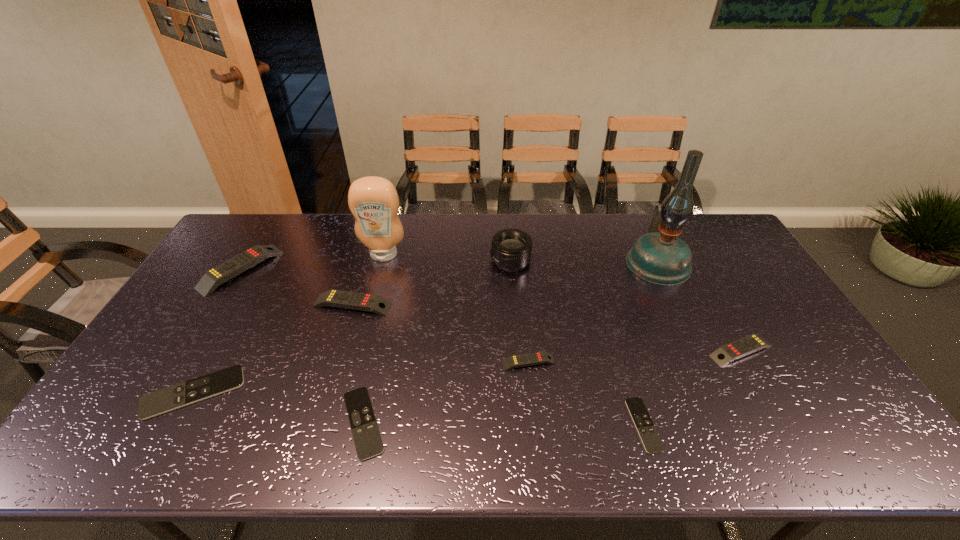
At what (x,y) coordinates should I click in order to perform the action: click on the fourth shortest remote control. Please return your answer as a coordinate pair (x, y). Looking at the image, I should click on (530, 359).

The height and width of the screenshot is (540, 960). Find the location of `the eighth tallest object`. the eighth tallest object is located at coordinates [x=173, y=397].

At what (x,y) coordinates should I click in order to perform the action: click on the leftmost black remote control. Please return your answer as a coordinate pair (x, y). Looking at the image, I should click on (173, 397).

You are a GUI agent. You are given a task and a screenshot of the screen. Output one action in this format:
    pyautogui.click(x=<x>, y=<y>)
    Task: Click on the second shortest object
    The image size is (960, 540).
    Given the screenshot: What is the action you would take?
    pyautogui.click(x=366, y=436)

Find the location of a particular element. The image size is (960, 540). the second black remote control from left to right is located at coordinates (366, 436).

You are a GUI agent. You are given a task and a screenshot of the screen. Output one action in this format:
    pyautogui.click(x=<x>, y=<y>)
    Task: Click on the shortest object
    This screenshot has width=960, height=540.
    Given the screenshot: What is the action you would take?
    pyautogui.click(x=652, y=443)

The image size is (960, 540). In order to click on the sixth remote control from left to right in this screenshot , I will do `click(652, 443)`.

I want to click on blank area located on the front of the tallest object, so click(x=679, y=308).

Find the location of a particular element. The height and width of the screenshot is (540, 960). blank space located on the label of the ninth shortest object is located at coordinates (373, 296).

Where is `vacant area situated on the side of the eighth shortest object with brand markings and control switches`? The height and width of the screenshot is (540, 960). vacant area situated on the side of the eighth shortest object with brand markings and control switches is located at coordinates (432, 261).